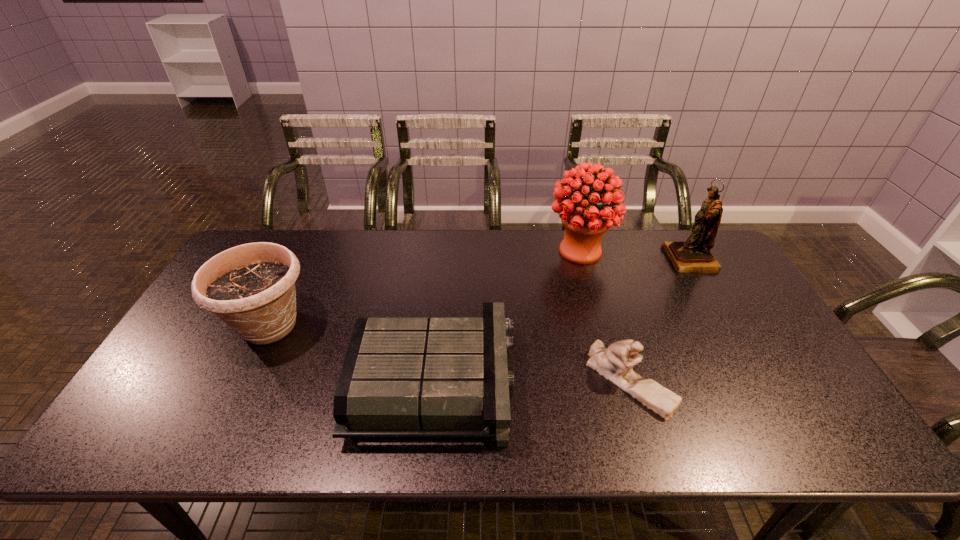
Where is `free space located on the front-facing side of the right figurine`? free space located on the front-facing side of the right figurine is located at coordinates (625, 260).

Locate an element on the screen. The height and width of the screenshot is (540, 960). blank area located 0.080m on the front-facing side of the right figurine is located at coordinates (642, 260).

Where is `vacant space located on the front-facing side of the right figurine`? vacant space located on the front-facing side of the right figurine is located at coordinates (610, 260).

The image size is (960, 540). In order to click on vacant space located on the right of the leftmost object in this screenshot , I will do `click(442, 326)`.

Image resolution: width=960 pixels, height=540 pixels. I want to click on free region located on the front panel of the second object from left to right, so click(x=542, y=382).

Locate an element on the screen. Image resolution: width=960 pixels, height=540 pixels. bouquet that is at the far edge is located at coordinates (585, 222).

Where is `figurine that is at the far edge`? figurine that is at the far edge is located at coordinates [x=693, y=255].

Locate an element on the screen. figurine located in the near edge section of the desktop is located at coordinates point(614,363).

You are a GUI agent. You are given a task and a screenshot of the screen. Output one action in this format:
    pyautogui.click(x=<x>, y=<y>)
    Task: Click on the radio receiver at the near edge
    This screenshot has width=960, height=540.
    Given the screenshot: What is the action you would take?
    pyautogui.click(x=403, y=376)

The width and height of the screenshot is (960, 540). Identify the location of object at the left edge. (251, 287).